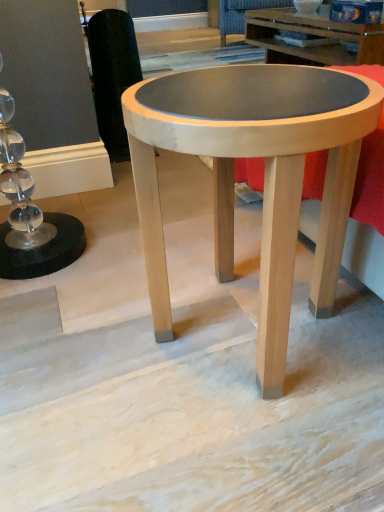
At what (x,y) coordinates should I click in order to perform the action: click on free area behind matte wood coffee table at center. Please return your answer as a coordinate pair (x, y). The width and height of the screenshot is (384, 512). Looking at the image, I should click on (189, 241).